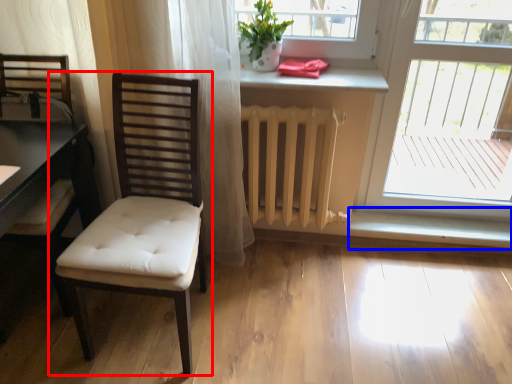
Question: Which of the following is the farthest to the observer, chair (highlighted by a red box) or window sill (highlighted by a blue box)?

Choices:
 (A) chair
 (B) window sill

Answer: (B)